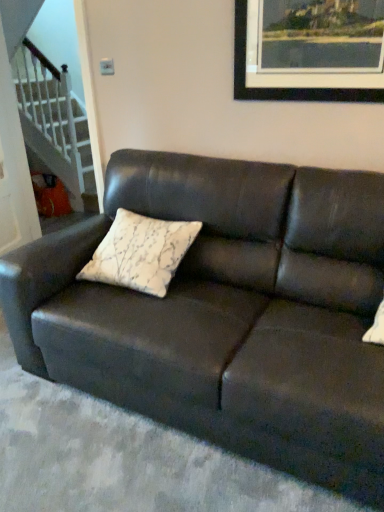
Question: Can you see white glossy staircase at lower left touching wooden picture frame at upper center?

Choices:
 (A) no
 (B) yes

Answer: (A)

Question: From the image's perspective, is white glossy staircase at lower left on top of wooden picture frame at upper center?

Choices:
 (A) no
 (B) yes

Answer: (B)

Question: From a real-world perspective, does white glossy staircase at lower left sit lower than wooden picture frame at upper center?

Choices:
 (A) no
 (B) yes

Answer: (B)

Question: Is white glossy staircase at lower left positioned in front of wooden picture frame at upper center?

Choices:
 (A) yes
 (B) no

Answer: (B)

Question: Can you confirm if white glossy staircase at lower left is positioned to the right of wooden picture frame at upper center?

Choices:
 (A) yes
 (B) no

Answer: (B)

Question: Does point (54, 80) appear closer or farther from the camera than point (221, 376)?

Choices:
 (A) farther
 (B) closer

Answer: (A)

Question: Is white glossy staircase at lower left in front of or behind matte black couch at center in the image?

Choices:
 (A) behind
 (B) front

Answer: (A)

Question: Looking at their shapes, would you say white glossy staircase at lower left is wider or thinner than matte black couch at center?

Choices:
 (A) thin
 (B) wide

Answer: (A)

Question: Would you say white glossy staircase at lower left is to the left or to the right of matte black couch at center in the picture?

Choices:
 (A) right
 (B) left

Answer: (B)

Question: Considering the positions of white textured pillow at center and wooden picture frame at upper center in the image, is white textured pillow at center taller or shorter than wooden picture frame at upper center?

Choices:
 (A) tall
 (B) short

Answer: (B)

Question: Do you think white textured pillow at center is within wooden picture frame at upper center, or outside of it?

Choices:
 (A) inside
 (B) outside

Answer: (B)

Question: Looking at the image, does white textured pillow at center seem bigger or smaller compared to wooden picture frame at upper center?

Choices:
 (A) small
 (B) big

Answer: (B)

Question: From the image's perspective, is white textured pillow at center above or below wooden picture frame at upper center?

Choices:
 (A) above
 (B) below

Answer: (B)

Question: Do you think matte black couch at center is within white textured pillow at center, or outside of it?

Choices:
 (A) inside
 (B) outside

Answer: (B)

Question: Considering their positions, is matte black couch at center located in front of or behind white textured pillow at center?

Choices:
 (A) front
 (B) behind

Answer: (A)